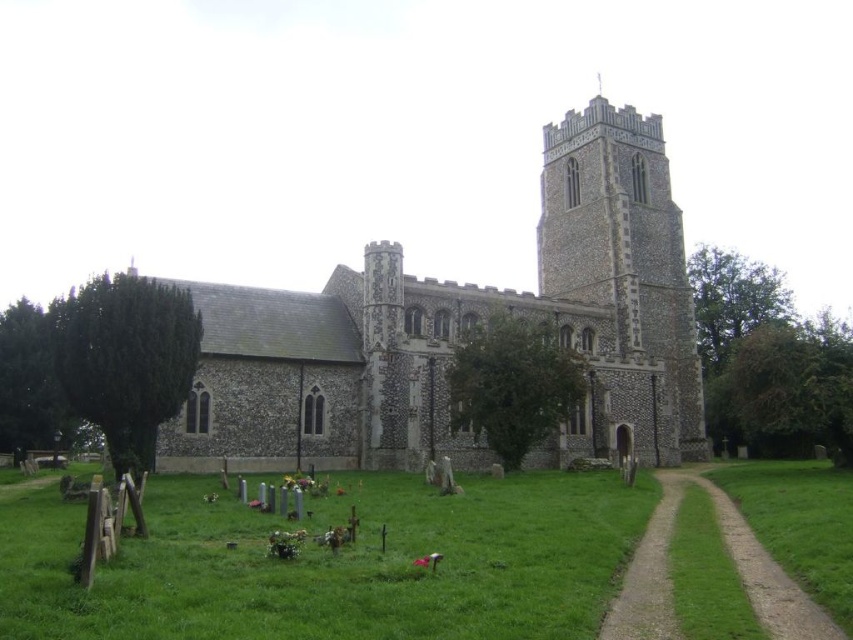
You are standing in a field 50 meters away from the stone church at center. You want to walk directly towards it. How many more meters do you need to walk to reach the church?

The stone church at center is 61.95 meters from the viewer. Since you are currently 50 meters away, you need to walk an additional 11.95 meters to reach it.

You are planning to take a photo of the stone church at center and the stone tower at center from a distance. Which one will appear bigger in the photo?

The stone church at center will appear bigger in the photo because it has a larger size compared to the stone tower at center.

You are standing in front of the historic church and want to take a photo. You notice two points marked in the image. The first point is at coordinates point (387, 400) and the second is at point (761, 611). Which point is closer to your camera?

Point (387, 400) is further to the camera than point (761, 611), so the point closer to your camera is point (761, 611).